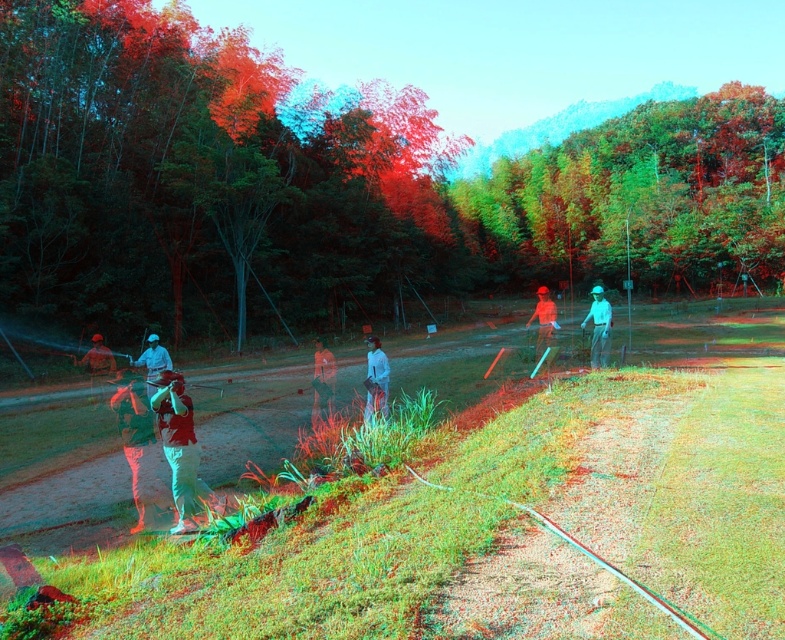
Is light blue fabric shirt at center thinner than matte orange shirt at center?

Correct, light blue fabric shirt at center's width is less than matte orange shirt at center's.

Does light blue fabric shirt at center appear on the left side of matte orange shirt at center?

Correct, you'll find light blue fabric shirt at center to the left of matte orange shirt at center.

Which is in front, point (375, 346) or point (553, 330)?

Point (375, 346)

Locate an element on the screen. The width and height of the screenshot is (785, 640). light blue fabric shirt at center is located at coordinates (375, 378).

Is orange fabric shirt at center further to camera compared to light gray fabric shirt at center?

That is False.

Which is in front, point (331, 369) or point (605, 314)?

Point (605, 314) is in front.

The image size is (785, 640). Identify the location of orange fabric shirt at center. pyautogui.click(x=322, y=380).

Between point (537, 312) and point (159, 349), which one is positioned behind?

The point (537, 312) is more distant.

Which of these two, matte orange shirt at center or white matte shirt at center, stands shorter?

white matte shirt at center is shorter.

Who is more distant from viewer, [546,346] or [150,376]?

Positioned behind is point [546,346].

Where is `matte orange shirt at center`? Image resolution: width=785 pixels, height=640 pixels. matte orange shirt at center is located at coordinates (543, 321).